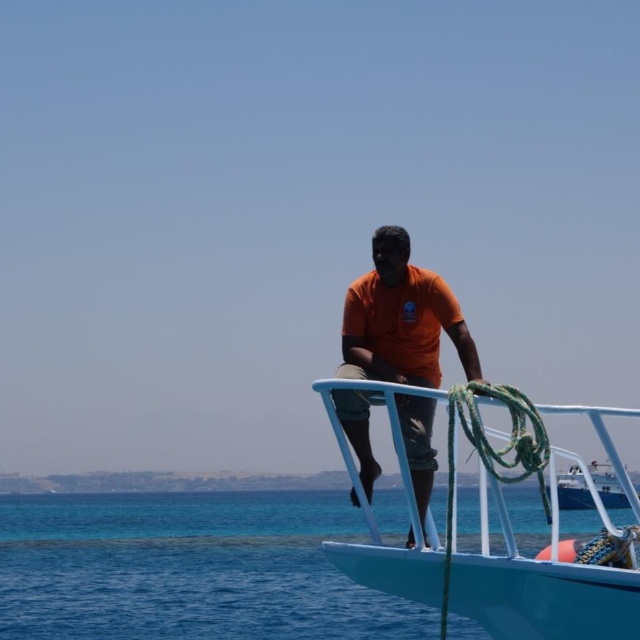
You are a photographer trying to capture the orange matte shirt at center and the white glossy boat at right in a single frame. Given their sizes, which object should you focus on to ensure both are clearly visible in the photo?

The orange matte shirt at center is smaller than the white glossy boat at right, so focusing on the white glossy boat at right would allow both objects to be clearly visible in the photo.

You are a photographer trying to capture the orange matte shirt at center in the best possible way. Given that the shirt is at point 0.500, 0.627, where should you position your camera to ensure the shirt is centered in the photo?

To center the orange matte shirt at center in the photo, position the camera at the same coordinates as the shirt, which is point (401,320).

You are standing on the deck of the boat and want to take a photo of both the point at coordinates (621, 609) and the point at coordinates (396, 362). Which point should you focus on first to ensure both are in focus?

You should focus on the point at coordinates (621, 609) first because it is closer to the camera than the point at coordinates (396, 362). This way, adjusting the focus from near to far will help both points be in focus.